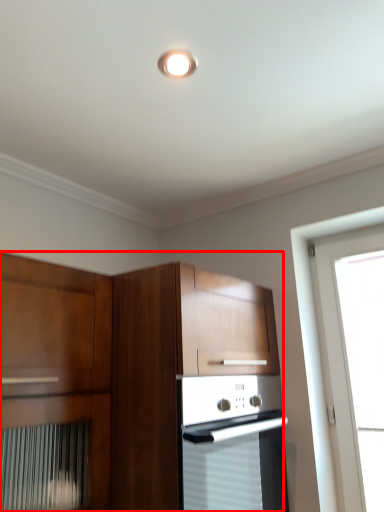
Question: Where is cabinetry (annotated by the red box) located in relation to light fixture in the image?

Choices:
 (A) right
 (B) left

Answer: (B)